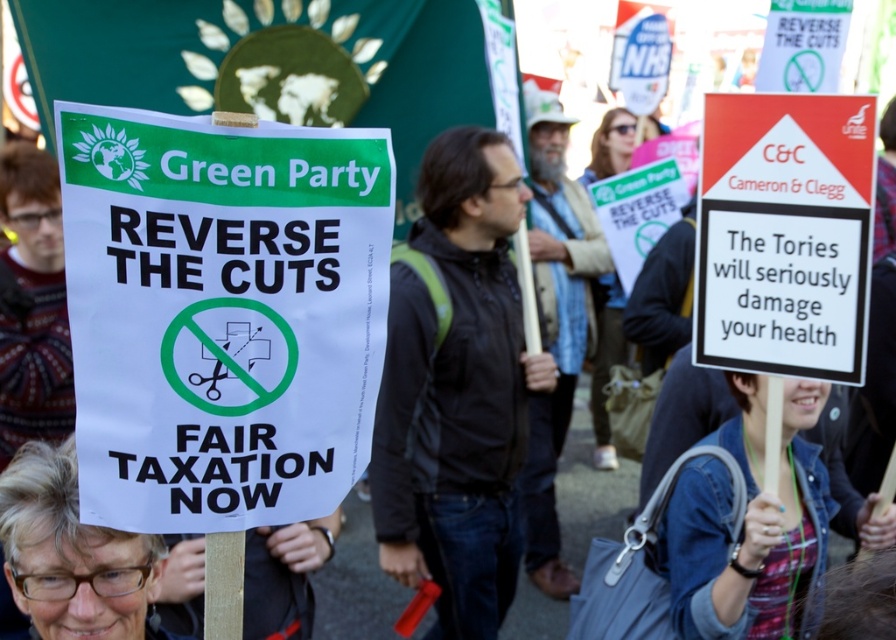
Does white paper sign at center appear under black jacket at center?

Actually, white paper sign at center is above black jacket at center.

In the scene shown: How distant is white paper sign at center from black jacket at center?

white paper sign at center and black jacket at center are 8.60 feet apart.

Describe the element at coordinates (221, 314) in the screenshot. The image size is (896, 640). I see `white paper sign at center` at that location.

The image size is (896, 640). Identify the location of white paper sign at center. (221, 314).